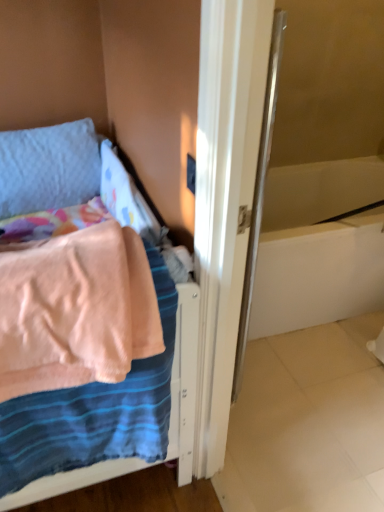
Consider the image. What is the approximate height of pink fabric bed at left?

The height of pink fabric bed at left is 22.82 inches.

Image resolution: width=384 pixels, height=512 pixels. Find the location of `textured blue pillow at upper left`. textured blue pillow at upper left is located at coordinates (48, 167).

Is point (82, 232) farther from camera compared to point (4, 154)?

No, it is not.

Can you confirm if pink fabric bed at left is shorter than textured blue pillow at upper left?

Incorrect, the height of pink fabric bed at left does not fall short of that of textured blue pillow at upper left.

In the scene shown: From the image's perspective, which one is positioned higher, pink fabric bed at left or textured blue pillow at upper left?

textured blue pillow at upper left, from the image's perspective.

Is white glossy bathtub at center right positioned in front of pink fabric bed at left?

No, white glossy bathtub at center right is further to the viewer.

Can you confirm if white glossy bathtub at center right is positioned to the right of pink fabric bed at left?

Yes, white glossy bathtub at center right is to the right of pink fabric bed at left.

Is point (333, 291) less distant than point (0, 362)?

No, (333, 291) is behind (0, 362).

Do you think white glossy bathtub at center right is within pink fabric bed at left, or outside of it?

white glossy bathtub at center right is located beyond the bounds of pink fabric bed at left.

Who is bigger, textured blue pillow at upper left or white glossy bathtub at center right?

With larger size is white glossy bathtub at center right.

Is white glossy bathtub at center right located within textured blue pillow at upper left?

No, white glossy bathtub at center right is located outside of textured blue pillow at upper left.

Does textured blue pillow at upper left have a greater height compared to pink fabric bed at left?

In fact, textured blue pillow at upper left may be shorter than pink fabric bed at left.

Between textured blue pillow at upper left and pink fabric bed at left, which one appears on the left side from the viewer's perspective?

textured blue pillow at upper left is more to the left.

From the image's perspective, which object appears higher, textured blue pillow at upper left or pink fabric bed at left?

From the image's view, textured blue pillow at upper left is above.

Between textured blue pillow at upper left and pink fabric bed at left, which one has smaller width?

textured blue pillow at upper left.

Does white glossy bathtub at center right have a greater height compared to textured blue pillow at upper left?

Yes, white glossy bathtub at center right is taller than textured blue pillow at upper left.

Considering the relative positions of white glossy bathtub at center right and textured blue pillow at upper left in the image provided, is white glossy bathtub at center right to the left of textured blue pillow at upper left from the viewer's perspective?

In fact, white glossy bathtub at center right is to the right of textured blue pillow at upper left.

Would you consider white glossy bathtub at center right to be distant from textured blue pillow at upper left?

No, white glossy bathtub at center right is not far from textured blue pillow at upper left.

Which point is more forward, (83, 287) or (321, 211)?

The point (83, 287) is in front.

From the image's perspective, is pink fabric bed at left beneath white glossy bathtub at center right?

Correct, pink fabric bed at left appears lower than white glossy bathtub at center right in the image.

Which is more to the right, pink fabric bed at left or white glossy bathtub at center right?

white glossy bathtub at center right.

Is pink fabric bed at left facing towards white glossy bathtub at center right?

No, pink fabric bed at left is not facing towards white glossy bathtub at center right.

Find the location of `bed on the right of the textured blue pillow at upper left`. bed on the right of the textured blue pillow at upper left is located at coordinates (94, 355).

Locate an element on the screen. bath below the pink fabric bed at left (from a real-world perspective) is located at coordinates (319, 246).

Looking at this image, based on their spatial positions, is textured blue pillow at upper left or white glossy bathtub at center right closer to pink fabric bed at left?

Among the two, textured blue pillow at upper left is located nearer to pink fabric bed at left.

When comparing their distances from white glossy bathtub at center right, does pink fabric bed at left or textured blue pillow at upper left seem closer?

Based on the image, pink fabric bed at left appears to be nearer to white glossy bathtub at center right.

Considering their positions, is pink fabric bed at left positioned further to textured blue pillow at upper left than white glossy bathtub at center right?

white glossy bathtub at center right.

Based on their spatial positions, is white glossy bathtub at center right or textured blue pillow at upper left further from pink fabric bed at left?

white glossy bathtub at center right lies further to pink fabric bed at left than the other object.

Estimate the real-world distances between objects in this image. Which object is further from white glossy bathtub at center right, textured blue pillow at upper left or pink fabric bed at left?

textured blue pillow at upper left is positioned further to the anchor white glossy bathtub at center right.

From the image, which object appears to be nearer to textured blue pillow at upper left, white glossy bathtub at center right or pink fabric bed at left?

pink fabric bed at left is closer to textured blue pillow at upper left.

Locate an element on the screen. bed located between textured blue pillow at upper left and white glossy bathtub at center right in the left-right direction is located at coordinates (94, 355).